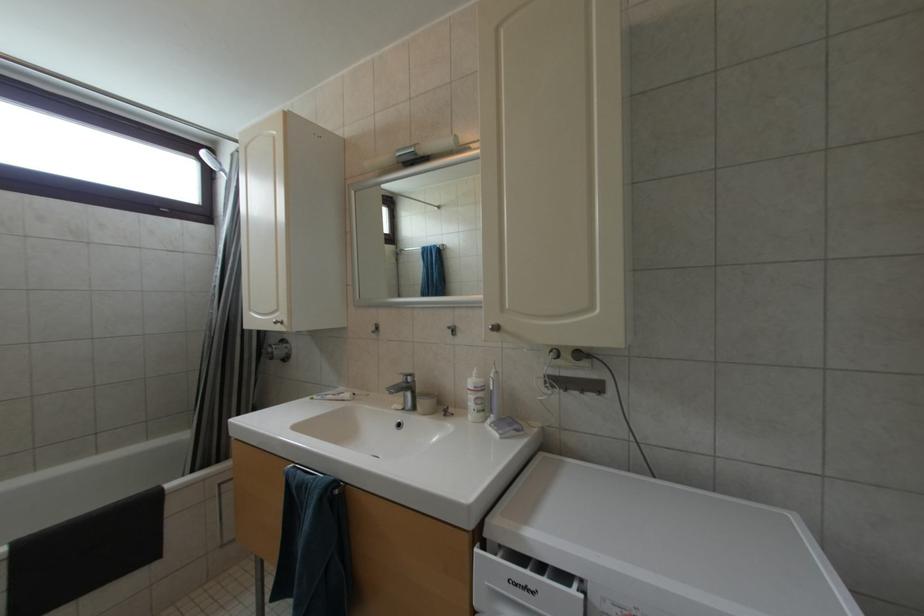
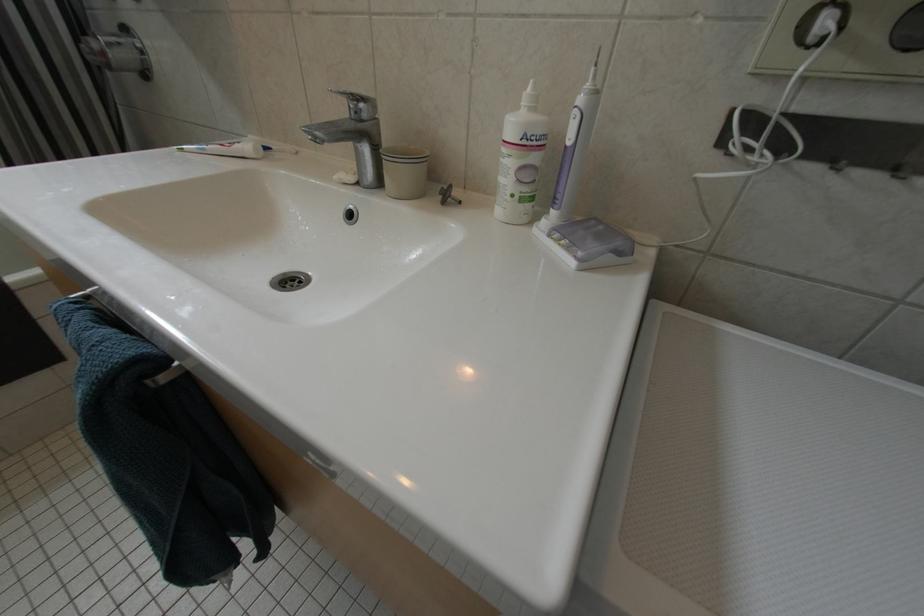
Question: The images are taken continuously from a first-person perspective. In which direction is your viewpoint rotating?

Choices:
 (A) Left
 (B) Right
 (C) Up
 (D) Down

Answer: (D)